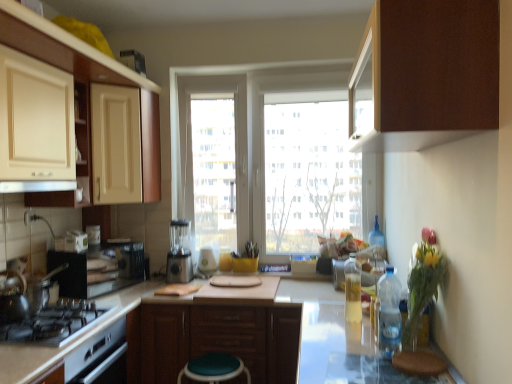
Locate an element on the screen. The height and width of the screenshot is (384, 512). empty space that is ontop of teal fabric stool at lower center, the second step stool viewed from the right (from a real-world perspective) is located at coordinates (217, 364).